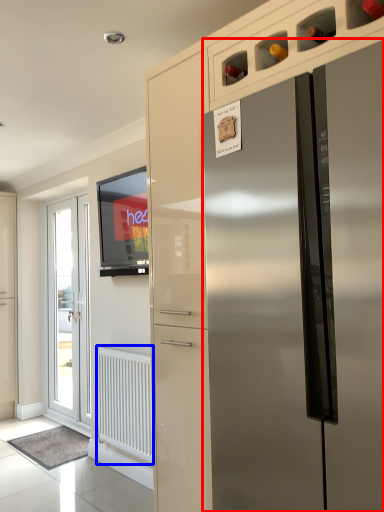
Question: Which object appears closest to the camera in this image, refrigerator (highlighted by a red box) or radiator (highlighted by a blue box)?

Choices:
 (A) refrigerator
 (B) radiator

Answer: (A)